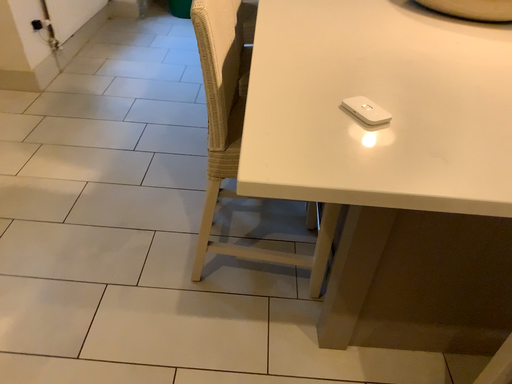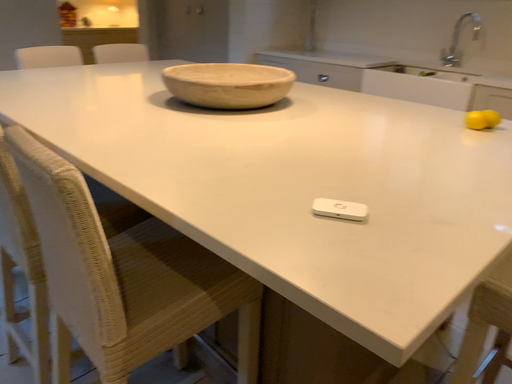
Question: Which way did the camera rotate in the video?

Choices:
 (A) rotated right
 (B) rotated left

Answer: (A)